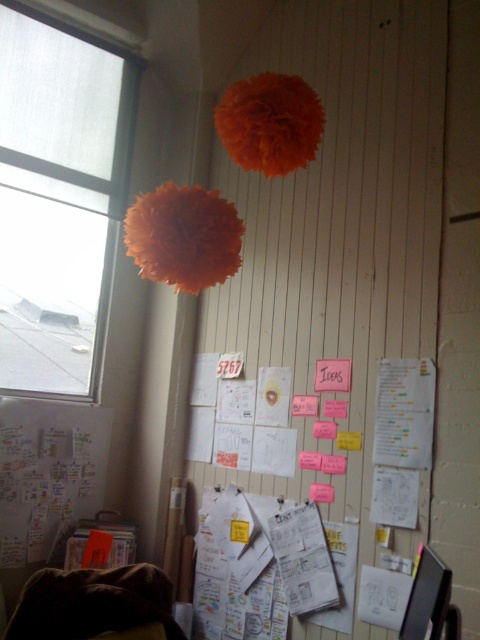
You are standing in the room shown in the image. You want to sit down on the brown fuzzy blanket at lower left. Where should you go to sit on it?

The brown fuzzy blanket at lower left is located at point (93, 604), so you should go to that coordinate to sit on it.

You are organizing a brainstorming session and need to place a new sticky note. You have a transparent glass window at upper left and a white paper at lower left. Which object is positioned higher up on the wall?

The transparent glass window at upper left is located above the white paper at lower left, so it is positioned higher up on the wall.

You are organizing a cozy reading corner in this room and want to place a 24 inch wide book on the floor. The brown fuzzy blanket at lower left and the yellow paper at center are already there. Can the book fit between them without overlapping?

The brown fuzzy blanket at lower left is 26.81 inches from the yellow paper at center. Since the book is 24 inches wide, it can fit between them as the distance is greater than the book width.